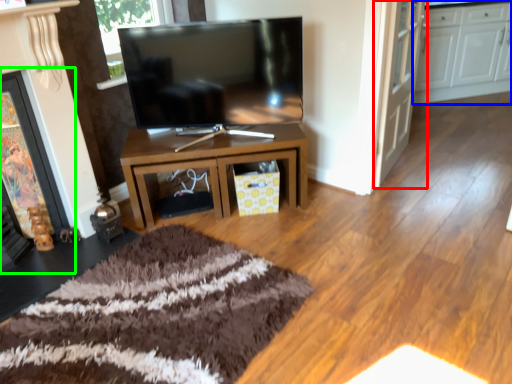
Question: Considering the real-world distances, which object is closest to door (highlighted by a red box)? cabinetry (highlighted by a blue box) or fireplace (highlighted by a green box).

Choices:
 (A) cabinetry
 (B) fireplace

Answer: (A)